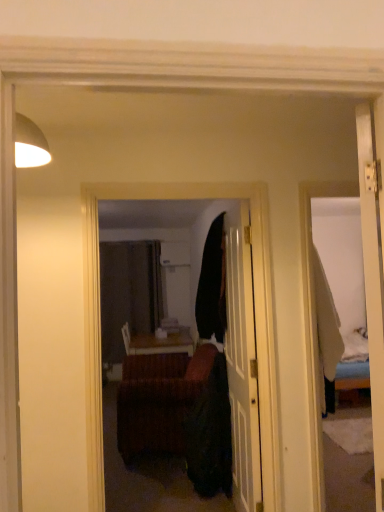
What do you see at coordinates (159, 400) in the screenshot?
I see `brown woven studio couch at center` at bounding box center [159, 400].

The height and width of the screenshot is (512, 384). I want to click on matte black door at center, so click(242, 360).

Can you confirm if brown woven studio couch at center is taller than woven wood table at center?

Indeed, brown woven studio couch at center has a greater height compared to woven wood table at center.

Is brown woven studio couch at center turned away from woven wood table at center?

Yes, brown woven studio couch at center's orientation is away from woven wood table at center.

Identify the location of table positioned vertically above the brown woven studio couch at center (from a real-world perspective). (157, 342).

Visually, is brown woven studio couch at center positioned to the left or to the right of woven wood table at center?

In the image, brown woven studio couch at center appears on the right side of woven wood table at center.

Does matte black door at center have a lesser height compared to matte black mirror at center?

No.

From the picture: From a real-world perspective, is matte black door at center physically located above or below matte black mirror at center?

In terms of real-world spatial position, matte black door at center is below matte black mirror at center.

Which is more to the right, matte black door at center or matte black mirror at center?

From the viewer's perspective, matte black door at center appears more on the right side.

Is matte black door at center far away from matte black mirror at center?

matte black door at center is positioned a significant distance from matte black mirror at center.

Based on the photo, is matte black mirror at center positioned in front of woven wood table at center?

That is True.

Which is behind, point (236, 451) or point (183, 330)?

The point (183, 330) is farther.

Can brown woven studio couch at center be found inside woven wood table at center?

No, brown woven studio couch at center is not a part of woven wood table at center.

There is a brown woven studio couch at center. Where is `table above it (from a real-world perspective)`? This screenshot has height=512, width=384. table above it (from a real-world perspective) is located at coordinates (157, 342).

From a real-world perspective, is woven wood table at center physically located above or below brown woven studio couch at center?

In terms of real-world spatial position, woven wood table at center is above brown woven studio couch at center.

Is point (172, 347) less distant than point (153, 439)?

No.

Is matte black mirror at center positioned with its back to matte black door at center?

Yes, matte black mirror at center's orientation is away from matte black door at center.

Is matte black mirror at center behind matte black door at center?

No, the depth of matte black mirror at center is less than that of matte black door at center.

Is matte black mirror at center positioned far away from matte black door at center?

matte black mirror at center is far away from matte black door at center.

Does matte black mirror at center appear on the right side of matte black door at center?

No, matte black mirror at center is not to the right of matte black door at center.

In the scene shown: Could you tell me if brown woven studio couch at center is turned towards matte black door at center?

Yes, brown woven studio couch at center is facing matte black door at center.

Considering the sizes of objects brown woven studio couch at center and matte black door at center in the image provided, who is wider, brown woven studio couch at center or matte black door at center?

Wider between the two is brown woven studio couch at center.

Does brown woven studio couch at center touch matte black door at center?

No, brown woven studio couch at center is not in contact with matte black door at center.

How distant is brown woven studio couch at center from matte black door at center?

They are 36.21 inches apart.

Looking at this image, how many degrees apart are the facing directions of woven wood table at center and matte black mirror at center?

woven wood table at center and matte black mirror at center are facing 0.00557 degrees away from each other.

Identify the location of table behind the matte black mirror at center. (157, 342).

From the image's perspective, is woven wood table at center under matte black mirror at center?

Yes, from the image's perspective, woven wood table at center is beneath matte black mirror at center.

Considering the points (157, 350) and (221, 351), which point is behind, point (157, 350) or point (221, 351)?

The point (157, 350) is behind.

Find the location of a particular element. studio couch that is under the woven wood table at center (from a real-world perspective) is located at coordinates (159, 400).

Where is `door that appears on the right of matte black mirror at center`? This screenshot has width=384, height=512. door that appears on the right of matte black mirror at center is located at coordinates (242, 360).

When comparing their distances from matte black door at center, does woven wood table at center or brown woven studio couch at center seem closer?

brown woven studio couch at center lies closer to matte black door at center than the other object.

Looking at this image, based on their spatial positions, is matte black mirror at center or matte black door at center closer to brown woven studio couch at center?

Based on the image, matte black door at center appears to be nearer to brown woven studio couch at center.

Which object lies nearer to the anchor point matte black mirror at center, brown woven studio couch at center or matte black door at center?

brown woven studio couch at center is closer to matte black mirror at center.

Based on their spatial positions, is brown woven studio couch at center or matte black mirror at center closer to matte black door at center?

brown woven studio couch at center is positioned closer to the anchor matte black door at center.

From the image, which object appears to be nearer to woven wood table at center, matte black door at center or brown woven studio couch at center?

→ brown woven studio couch at center is closer to woven wood table at center.

Based on their spatial positions, is brown woven studio couch at center or matte black mirror at center closer to woven wood table at center?

Among the two, matte black mirror at center is located nearer to woven wood table at center.

Looking at the image, which one is located closer to brown woven studio couch at center, woven wood table at center or matte black mirror at center?

woven wood table at center is positioned closer to the anchor brown woven studio couch at center.

From the image, which object appears to be nearer to woven wood table at center, matte black mirror at center or brown woven studio couch at center?

matte black mirror at center is closer to woven wood table at center.

Locate an element on the screen. The image size is (384, 512). studio couch between matte black mirror at center and woven wood table at center from front to back is located at coordinates (159, 400).

Find the location of a particular element. This screenshot has width=384, height=512. door located between matte black mirror at center and brown woven studio couch at center in the depth direction is located at coordinates (242, 360).

Identify the location of studio couch between matte black door at center and woven wood table at center from front to back. The image size is (384, 512). (159, 400).

This screenshot has height=512, width=384. Identify the location of door positioned between matte black mirror at center and woven wood table at center from near to far. (242, 360).